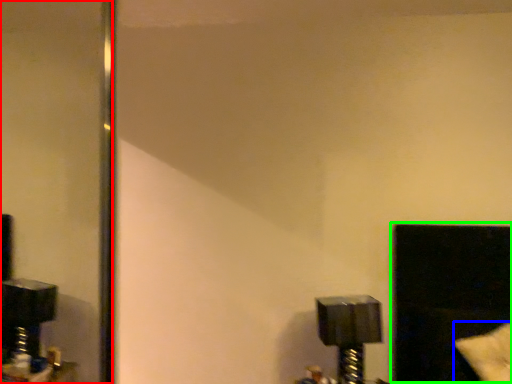
Question: Which is nearer to the mirror (highlighted by a red box)? pillow (highlighted by a blue box) or window (highlighted by a green box).

Choices:
 (A) pillow
 (B) window

Answer: (B)